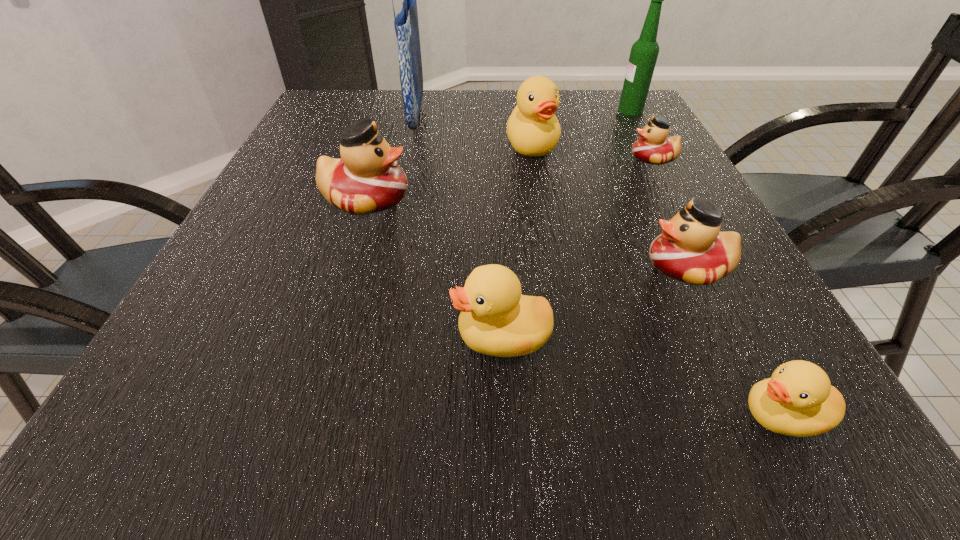
You are a GUI agent. You are given a task and a screenshot of the screen. Output one action in this format:
    pyautogui.click(x=<x>, y=<y>)
    Task: Click on the free space between the biggest yellow duck and the farthest red duck
    
    Given the screenshot: What is the action you would take?
    pyautogui.click(x=593, y=152)

Image resolution: width=960 pixels, height=540 pixels. I want to click on free space between the third nearest object and the smallest red duck, so click(670, 212).

Find the location of `the fifth closest object to the farthest yellow duck`. the fifth closest object to the farthest yellow duck is located at coordinates (691, 249).

Find the location of a particular element. object that stands as the sixth closest to the biggest yellow duck is located at coordinates (495, 319).

The height and width of the screenshot is (540, 960). Find the location of `duck that is the fourth nearest to the second biggest yellow duck`. duck that is the fourth nearest to the second biggest yellow duck is located at coordinates (533, 130).

Select which duck is the fourth closest to the second smallest red duck. Please provide its 2D coordinates. Your answer should be formatted as a tuple, i.e. [(x, y)], where the tuple contains the x and y coordinates of a point satisfying the conditions above.

[(533, 130)]

The height and width of the screenshot is (540, 960). In order to click on red duck that can be found as the closest to the smallest red duck in this screenshot , I will do `click(691, 249)`.

The image size is (960, 540). I want to click on red duck that is the closest to the nearest duck, so click(x=691, y=249).

Where is `the second closest yellow duck relative to the biggest red duck`? the second closest yellow duck relative to the biggest red duck is located at coordinates (495, 319).

Identify which yellow duck is located as the nearest to the biggest yellow duck. Please provide its 2D coordinates. Your answer should be formatted as a tuple, i.e. [(x, y)], where the tuple contains the x and y coordinates of a point satisfying the conditions above.

[(495, 319)]